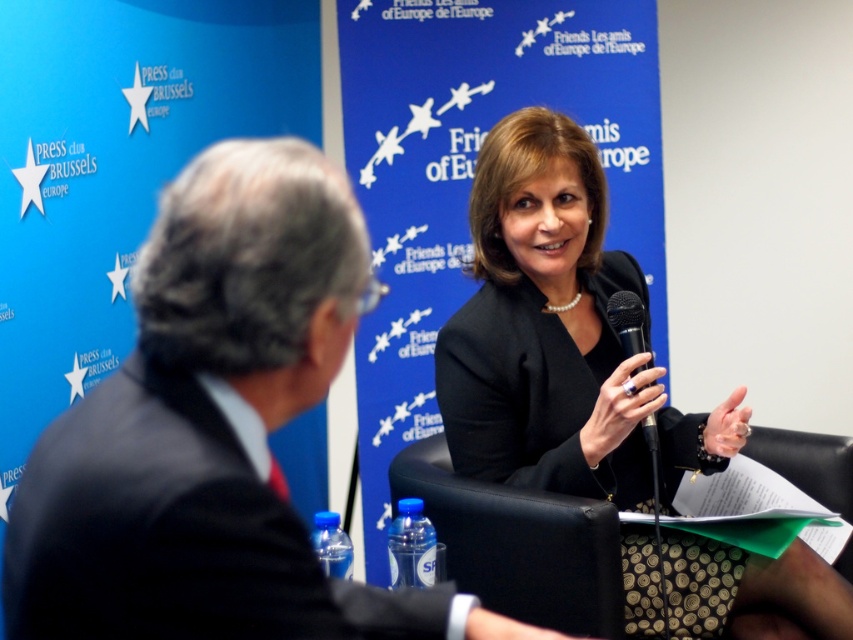
Is dark suit at center to the left of black glossy suit at center from the viewer's perspective?

Indeed, dark suit at center is positioned on the left side of black glossy suit at center.

Is dark suit at center smaller than black glossy suit at center?

Correct, dark suit at center occupies less space than black glossy suit at center.

At what (x,y) coordinates should I click in order to perform the action: click on dark suit at center. Please return your answer as a coordinate pair (x, y). Looking at the image, I should click on (213, 429).

You are a GUI agent. You are given a task and a screenshot of the screen. Output one action in this format:
    pyautogui.click(x=<x>, y=<y>)
    Task: Click on the dark suit at center
    The image size is (853, 640).
    Given the screenshot: What is the action you would take?
    pyautogui.click(x=213, y=429)

Which of these two, black glossy suit at center or black metallic microphone at center, stands shorter?

Standing shorter between the two is black metallic microphone at center.

Between black glossy suit at center and black metallic microphone at center, which one appears on the right side from the viewer's perspective?

black metallic microphone at center is more to the right.

Which is behind, point (543, 264) or point (613, 308)?

The point (543, 264) is behind.

The height and width of the screenshot is (640, 853). In order to click on black glossy suit at center in this screenshot , I will do `click(558, 337)`.

Who is higher up, dark blue fabric suit at right or black metallic microphone at center?

black metallic microphone at center is higher up.

Who is more distant from viewer, (207, 556) or (640, 352)?

Point (640, 352)

At what (x,y) coordinates should I click in order to perform the action: click on dark blue fabric suit at right. Please return your answer as a coordinate pair (x, y). Looking at the image, I should click on (173, 532).